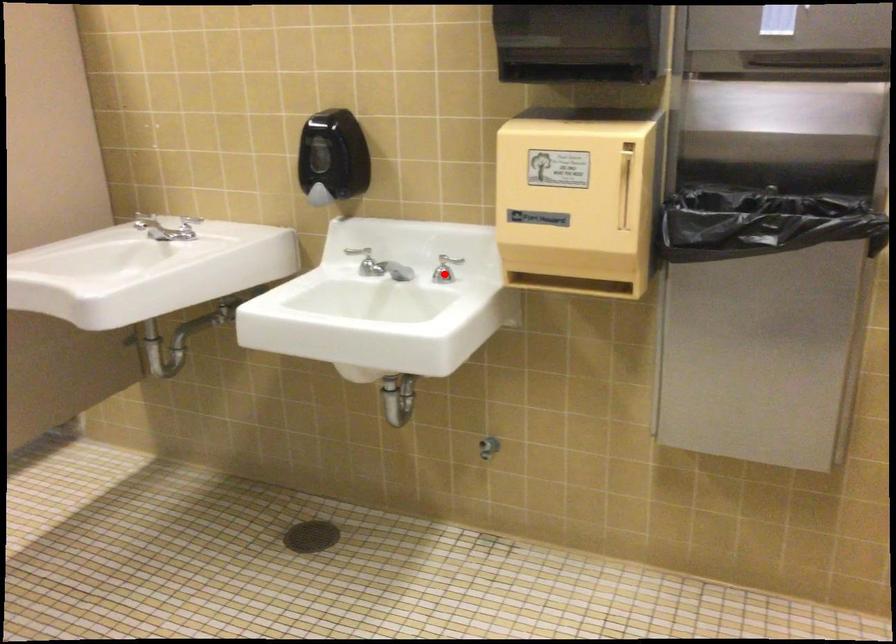
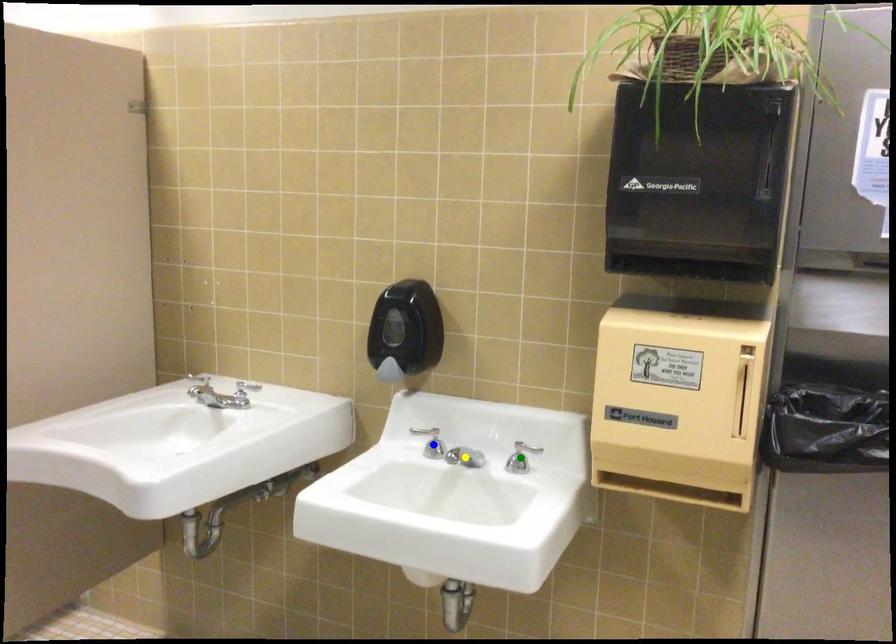
Question: I am providing you with two images of the same scene from different viewpoints. A red point is marked on the first image. You are given multiple points on the second image. Which point in image 2 is actually the same real-world point as the red point in image 1?

Choices:
 (A) yellow point
 (B) blue point
 (C) green point

Answer: (C)